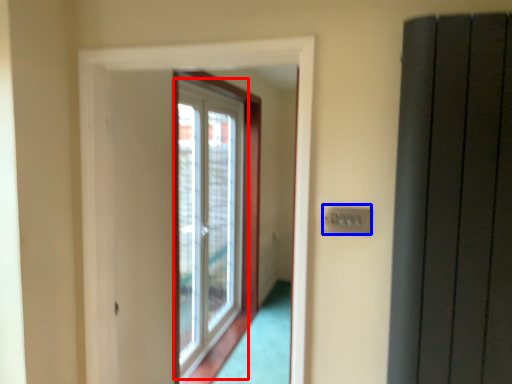
Question: Which object appears farthest to the camera in this image, window (highlighted by a red box) or electric outlet (highlighted by a blue box)?

Choices:
 (A) window
 (B) electric outlet

Answer: (A)